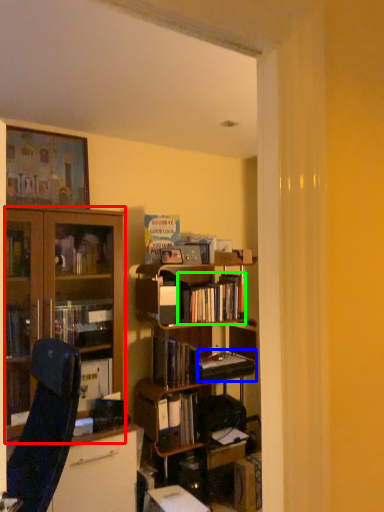
Question: Which is farther away from cabinetry (highlighted by a red box)? paperback book (highlighted by a blue box) or book (highlighted by a green box)?

Choices:
 (A) paperback book
 (B) book

Answer: (A)